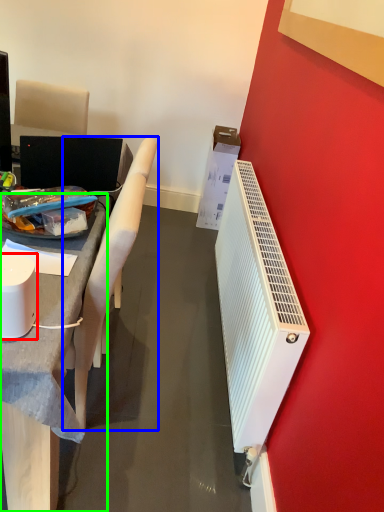
Question: Based on their relative distances, which object is nearer to appliance (highlighted by a red box)? Choose from chair (highlighted by a blue box) and desk (highlighted by a green box).

Choices:
 (A) chair
 (B) desk

Answer: (B)